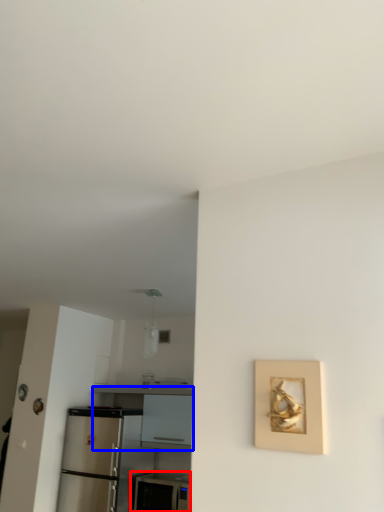
Question: Which object appears closest to the camera in this image, appliance (highlighted by a red box) or counter (highlighted by a blue box)?

Choices:
 (A) appliance
 (B) counter

Answer: (A)